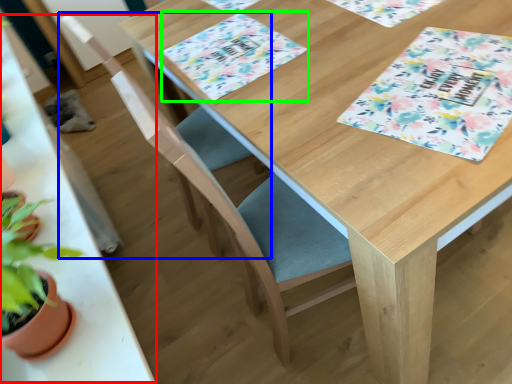
Question: Based on their relative distances, which object is farther from round table (highlighted by a red box)? Choose from folding chair (highlighted by a blue box) and place mat (highlighted by a green box).

Choices:
 (A) folding chair
 (B) place mat

Answer: (A)